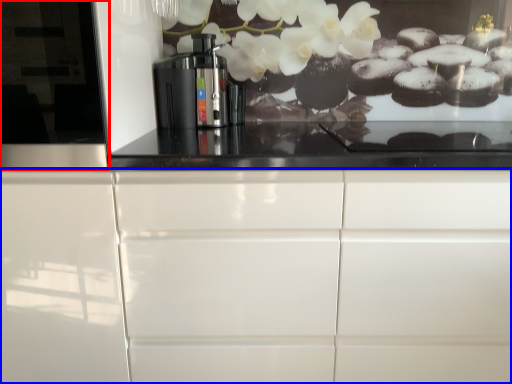
Question: Which of the following is the farthest to the observer, glass door (highlighted by a red box) or cabinetry (highlighted by a blue box)?

Choices:
 (A) glass door
 (B) cabinetry

Answer: (B)